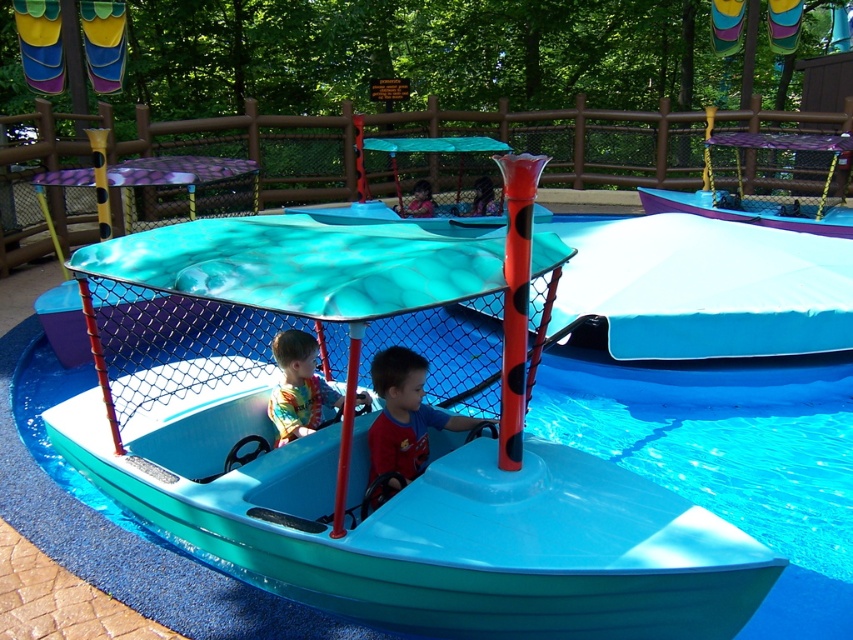
Does red shirt at center have a lesser height compared to matte blue shirt at center?

No.

Who is lower down, red shirt at center or matte blue shirt at center?

red shirt at center is below.

Is point (422, 460) behind point (426, 193)?

No, it is not.

Find the location of a particular element. red shirt at center is located at coordinates (405, 413).

Can you confirm if rainbow striped shirt at center is bigger than matte blue shirt at center?

Correct, rainbow striped shirt at center is larger in size than matte blue shirt at center.

Which is more to the right, rainbow striped shirt at center or matte blue shirt at center?

From the viewer's perspective, matte blue shirt at center appears more on the right side.

What do you see at coordinates (299, 387) in the screenshot? The image size is (853, 640). I see `rainbow striped shirt at center` at bounding box center [299, 387].

Identify the location of rainbow striped shirt at center. Image resolution: width=853 pixels, height=640 pixels. (299, 387).

Can you confirm if red shirt at center is positioned to the right of rainbow striped shirt at center?

Correct, you'll find red shirt at center to the right of rainbow striped shirt at center.

Who is positioned more to the left, red shirt at center or rainbow striped shirt at center?

Positioned to the left is rainbow striped shirt at center.

Who is more distant from viewer, (410, 436) or (314, 374)?

Point (314, 374)

Image resolution: width=853 pixels, height=640 pixels. In order to click on red shirt at center in this screenshot , I will do `click(405, 413)`.